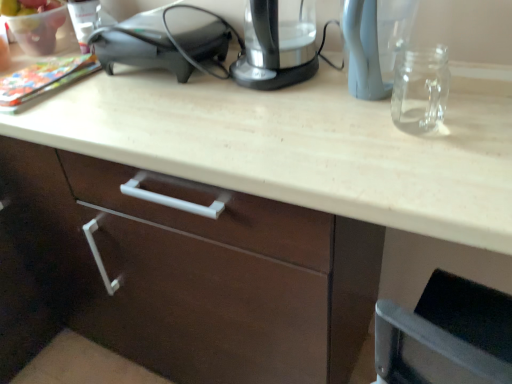
Question: Does satin black speaker at upper left touch transparent plastic kettle at upper center?

Choices:
 (A) no
 (B) yes

Answer: (A)

Question: Does satin black speaker at upper left come in front of transparent plastic kettle at upper center?

Choices:
 (A) yes
 (B) no

Answer: (B)

Question: From a real-world perspective, is satin black speaker at upper left under transparent plastic kettle at upper center?

Choices:
 (A) yes
 (B) no

Answer: (A)

Question: Is satin black speaker at upper left facing towards transparent plastic kettle at upper center?

Choices:
 (A) yes
 (B) no

Answer: (B)

Question: Is satin black speaker at upper left shorter than transparent plastic kettle at upper center?

Choices:
 (A) yes
 (B) no

Answer: (A)

Question: Is satin black speaker at upper left facing away from transparent plastic kettle at upper center?

Choices:
 (A) no
 (B) yes

Answer: (A)

Question: Is transparent plastic kettle at upper center outside satin black speaker at upper left?

Choices:
 (A) no
 (B) yes

Answer: (B)

Question: From a real-world perspective, is transparent plastic kettle at upper center over satin black speaker at upper left?

Choices:
 (A) no
 (B) yes

Answer: (B)

Question: Does transparent plastic kettle at upper center come behind satin black speaker at upper left?

Choices:
 (A) no
 (B) yes

Answer: (A)

Question: Considering the relative sizes of transparent plastic kettle at upper center and satin black speaker at upper left in the image provided, is transparent plastic kettle at upper center taller than satin black speaker at upper left?

Choices:
 (A) no
 (B) yes

Answer: (B)

Question: Is transparent plastic kettle at upper center turned away from satin black speaker at upper left?

Choices:
 (A) yes
 (B) no

Answer: (B)

Question: Is transparent plastic kettle at upper center facing towards satin black speaker at upper left?

Choices:
 (A) no
 (B) yes

Answer: (A)

Question: Is satin black speaker at upper left taller or shorter than transparent plastic kettle at upper center?

Choices:
 (A) tall
 (B) short

Answer: (B)